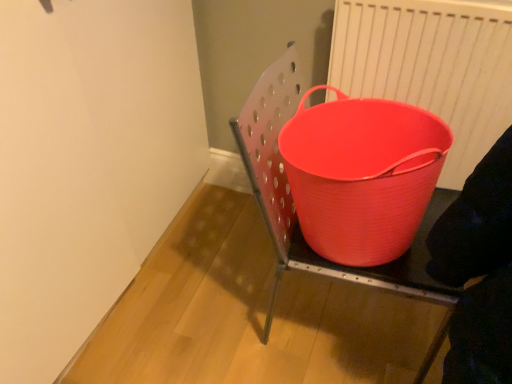
What do you see at coordinates (362, 175) in the screenshot? I see `matte plastic bucket at center` at bounding box center [362, 175].

Image resolution: width=512 pixels, height=384 pixels. In order to click on matte plastic bucket at center in this screenshot , I will do `click(295, 210)`.

The height and width of the screenshot is (384, 512). Identify the location of matte plastic bucket at center. (362, 175).

Can you confirm if white plastic radiator at upper right is taller than matte plastic bucket at center?

Correct, white plastic radiator at upper right is much taller as matte plastic bucket at center.

Between white plastic radiator at upper right and matte plastic bucket at center, which one has larger width?

matte plastic bucket at center is wider.

Is white plastic radiator at upper right aimed at matte plastic bucket at center?

Yes, white plastic radiator at upper right is facing matte plastic bucket at center.

From a real-world perspective, who is located lower, white plastic radiator at upper right or matte plastic bucket at center?

matte plastic bucket at center, from a real-world perspective.

Considering the positions of objects matte plastic bucket at center and matte plastic bucket at center in the image provided, who is behind, matte plastic bucket at center or matte plastic bucket at center?

Positioned behind is matte plastic bucket at center.

Is matte plastic bucket at center touching matte plastic bucket at center?

No, matte plastic bucket at center is not beside matte plastic bucket at center.

From a real-world perspective, which is physically above, matte plastic bucket at center or matte plastic bucket at center?

From a 3D spatial view, matte plastic bucket at center is above.

Is matte plastic bucket at center not within white plastic radiator at upper right?

Indeed, matte plastic bucket at center is completely outside white plastic radiator at upper right.

Is the position of matte plastic bucket at center less distant than that of white plastic radiator at upper right?

Yes.

Considering the sizes of matte plastic bucket at center and white plastic radiator at upper right in the image, is matte plastic bucket at center wider or thinner than white plastic radiator at upper right?

In the image, matte plastic bucket at center appears to be wider than white plastic radiator at upper right.

Which of these two, matte plastic bucket at center or white plastic radiator at upper right, is bigger?

With larger size is matte plastic bucket at center.

Does matte plastic bucket at right have a greater height compared to white plastic radiator at upper right?

No, matte plastic bucket at right is not taller than white plastic radiator at upper right.

Considering the relative sizes of matte plastic bucket at right and white plastic radiator at upper right in the image provided, is matte plastic bucket at right thinner than white plastic radiator at upper right?

No.

This screenshot has height=384, width=512. Identify the location of radiator located above the matte plastic bucket at right (from the image's perspective). (431, 66).

What's the angular difference between matte plastic bucket at right and white plastic radiator at upper right's facing directions?

They differ by 1.62 degrees in their facing directions.

Does point (460, 130) come behind point (330, 273)?

Yes, it is.

Considering the relative positions of white plastic radiator at upper right and matte plastic bucket at center in the image provided, is white plastic radiator at upper right to the right of matte plastic bucket at center from the viewer's perspective?

Yes, white plastic radiator at upper right is to the right of matte plastic bucket at center.

Is white plastic radiator at upper right wider than matte plastic bucket at center?

No.

Considering the relative sizes of white plastic radiator at upper right and matte plastic bucket at center in the image provided, is white plastic radiator at upper right smaller than matte plastic bucket at center?

Yes, white plastic radiator at upper right is smaller than matte plastic bucket at center.

Is matte plastic bucket at right a part of matte plastic bucket at center?

No, matte plastic bucket at right is not surrounded by matte plastic bucket at center.

Which is nearer, (415,153) or (441,354)?

The point (415,153) is closer to the camera.

Is matte plastic bucket at center aimed at matte plastic bucket at right?

No, matte plastic bucket at center does not turn towards matte plastic bucket at right.

How many degrees apart are the facing directions of matte plastic bucket at center and matte plastic bucket at right?

0.436 degrees separate the facing orientations of matte plastic bucket at center and matte plastic bucket at right.

Would you say matte plastic bucket at center is inside or outside white plastic radiator at upper right?

matte plastic bucket at center is spatially situated outside white plastic radiator at upper right.

Which point is more distant from viewer, (x=394, y=163) or (x=508, y=74)?

The point (x=394, y=163) is more distant.

Would you say matte plastic bucket at center is to the left or to the right of white plastic radiator at upper right in the picture?

From the image, it's evident that matte plastic bucket at center is to the left of white plastic radiator at upper right.

Identify the location of radiator lying on the right of matte plastic bucket at center. The width and height of the screenshot is (512, 384). (431, 66).

In the image, there is a matte plastic bucket at center. Identify the location of furniture below it (from the image's perspective). This screenshot has width=512, height=384. (295, 210).

Looking at the image, which one is located further to matte plastic bucket at right, matte plastic bucket at center or matte plastic bucket at center?

matte plastic bucket at center lies further to matte plastic bucket at right than the other object.

Considering their positions, is white plastic radiator at upper right positioned closer to matte plastic bucket at right than matte plastic bucket at center?

The object closer to matte plastic bucket at right is matte plastic bucket at center.

Looking at the image, which one is located further to matte plastic bucket at center, matte plastic bucket at center or matte plastic bucket at right?

Based on the image, matte plastic bucket at right appears to be further to matte plastic bucket at center.

From the picture: Looking at the image, which one is located closer to matte plastic bucket at center, matte plastic bucket at center or matte plastic bucket at right?

The object closer to matte plastic bucket at center is matte plastic bucket at center.

Based on their spatial positions, is matte plastic bucket at center or matte plastic bucket at right further from white plastic radiator at upper right?

Among the two, matte plastic bucket at right is located further to white plastic radiator at upper right.

When comparing their distances from matte plastic bucket at center, does white plastic radiator at upper right or matte plastic bucket at right seem further?

matte plastic bucket at right lies further to matte plastic bucket at center than the other object.

When comparing their distances from matte plastic bucket at center, does matte plastic bucket at right or matte plastic bucket at center seem further?

matte plastic bucket at right is positioned further to the anchor matte plastic bucket at center.

Which object lies further to the anchor point white plastic radiator at upper right, matte plastic bucket at center or matte plastic bucket at right?

Among the two, matte plastic bucket at right is located further to white plastic radiator at upper right.

At what (x,y) coordinates should I click in order to perform the action: click on furniture between white plastic radiator at upper right and matte plastic bucket at right in the vertical direction. Please return your answer as a coordinate pair (x, y). Looking at the image, I should click on (295, 210).

Where is `basket between white plastic radiator at upper right and matte plastic bucket at center vertically`? Image resolution: width=512 pixels, height=384 pixels. basket between white plastic radiator at upper right and matte plastic bucket at center vertically is located at coordinates (362, 175).

In order to click on furniture that lies between matte plastic bucket at center and matte plastic bucket at right from top to bottom in this screenshot , I will do `click(295, 210)`.

Where is `basket between white plastic radiator at upper right and matte plastic bucket at right from top to bottom`? The image size is (512, 384). basket between white plastic radiator at upper right and matte plastic bucket at right from top to bottom is located at coordinates (362, 175).